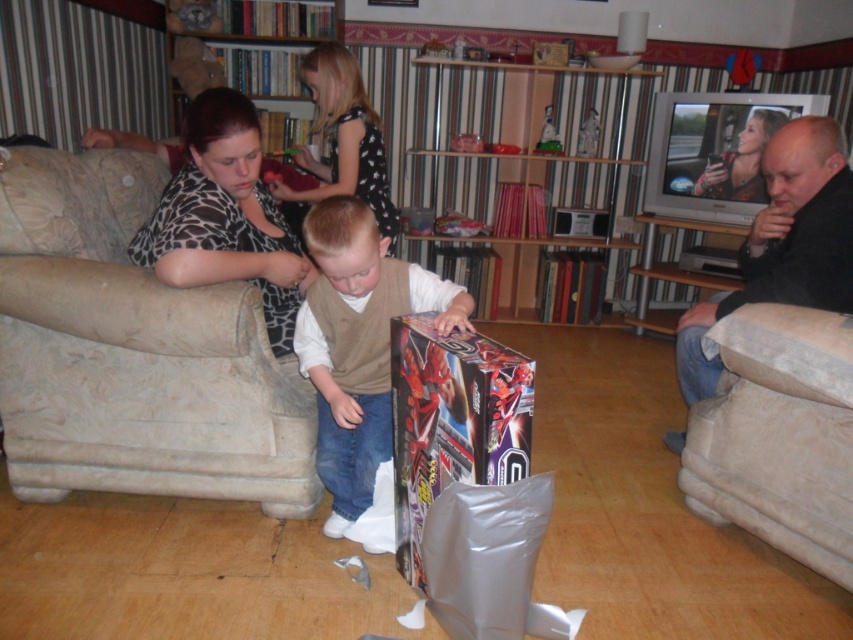
Which is above, beige fabric armchair at right or metallic silver toy at center?

metallic silver toy at center is above.

Is beige fabric armchair at right below metallic silver toy at center?

Yes, beige fabric armchair at right is below metallic silver toy at center.

You are a GUI agent. You are given a task and a screenshot of the screen. Output one action in this format:
    pyautogui.click(x=<x>, y=<y>)
    Task: Click on the beige fabric armchair at right
    
    Given the screenshot: What is the action you would take?
    pyautogui.click(x=778, y=435)

Between black dotted dress at upper center and wooden bookshelf at upper center, which one has less height?

Standing shorter between the two is wooden bookshelf at upper center.

Who is more forward, (346, 51) or (254, 4)?

Point (346, 51) is more forward.

Where is `black dotted dress at upper center`? black dotted dress at upper center is located at coordinates (343, 140).

Is black dotted dress at upper center further to the viewer compared to plastic toy figure at upper center?

No, it is not.

This screenshot has width=853, height=640. What do you see at coordinates (343, 140) in the screenshot? I see `black dotted dress at upper center` at bounding box center [343, 140].

What are the coordinates of `black dotted dress at upper center` in the screenshot? It's located at (343, 140).